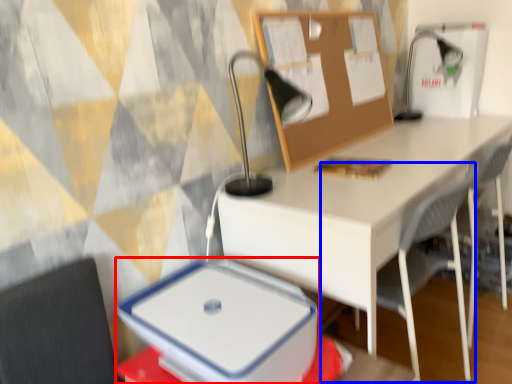
Question: Which object is further to the camera taking this photo, lunch box (highlighted by a red box) or armchair (highlighted by a blue box)?

Choices:
 (A) lunch box
 (B) armchair

Answer: (B)